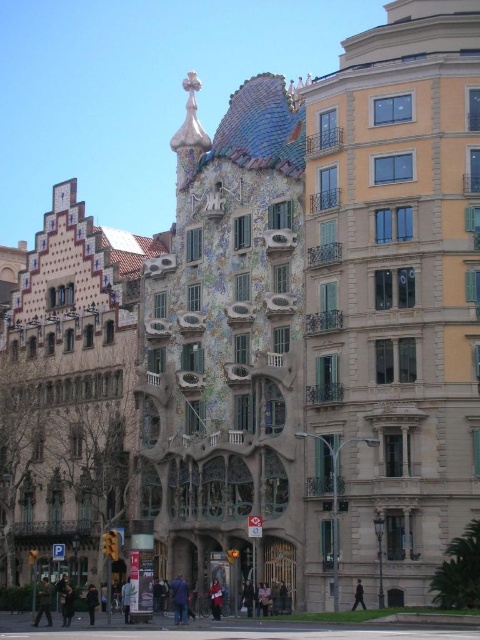
I want to click on red fabric coat at center, so click(x=216, y=598).

Is dark gray pants at lower left behind black fabric coat at center?

Yes.

Is dark gray pants at lower left closer to camera compared to black fabric coat at center?

No, it is behind black fabric coat at center.

Does point (47, 618) come in front of point (361, 588)?

No, it is not.

The height and width of the screenshot is (640, 480). Identify the location of dark gray pants at lower left. (44, 602).

Which is below, dark brown leather coat at lower center or dark blue jeans at center?

dark brown leather coat at lower center is lower down.

This screenshot has width=480, height=640. What do you see at coordinates (92, 602) in the screenshot?
I see `dark brown leather coat at lower center` at bounding box center [92, 602].

At what (x,y) coordinates should I click in order to perform the action: click on dark brown leather coat at lower center. Please return your answer as a coordinate pair (x, y). Looking at the image, I should click on (92, 602).